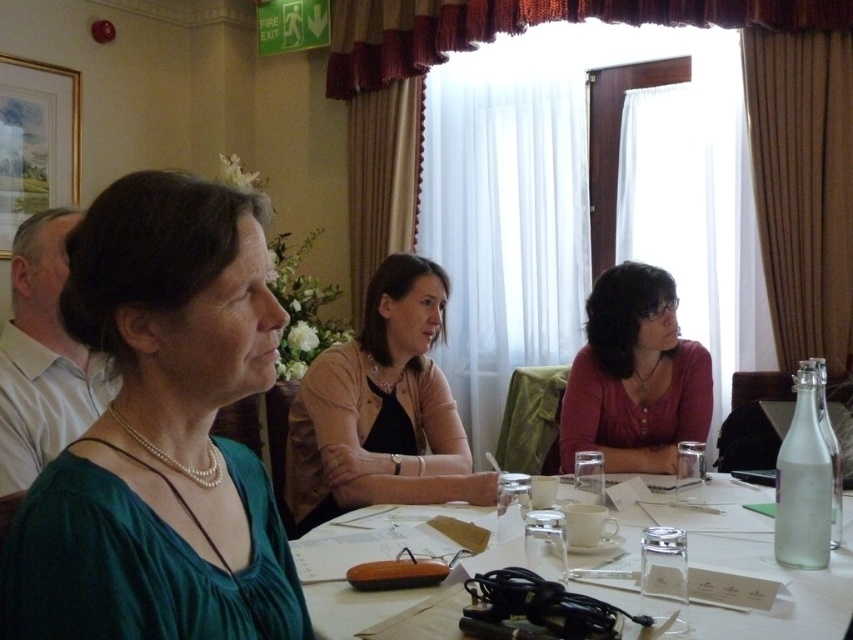
Question: Among these points, which one is farthest from the camera?

Choices:
 (A) (340, 432)
 (B) (360, 627)
 (C) (221, 227)

Answer: (A)

Question: Which object appears closest to the camera in this image?

Choices:
 (A) pink fabric shirt at center
 (B) white shirt at left
 (C) pink matte shirt at center

Answer: (B)

Question: Based on their relative distances, which object is nearer to the green silk blouse at center?

Choices:
 (A) pink matte shirt at center
 (B) pink fabric shirt at center

Answer: (B)

Question: Is green silk blouse at center thinner than clear glass water at center?

Choices:
 (A) no
 (B) yes

Answer: (B)

Question: Does green silk blouse at center have a lesser width compared to white shirt at left?

Choices:
 (A) no
 (B) yes

Answer: (B)

Question: Can you confirm if clear glass water at center is wider than white shirt at left?

Choices:
 (A) yes
 (B) no

Answer: (A)